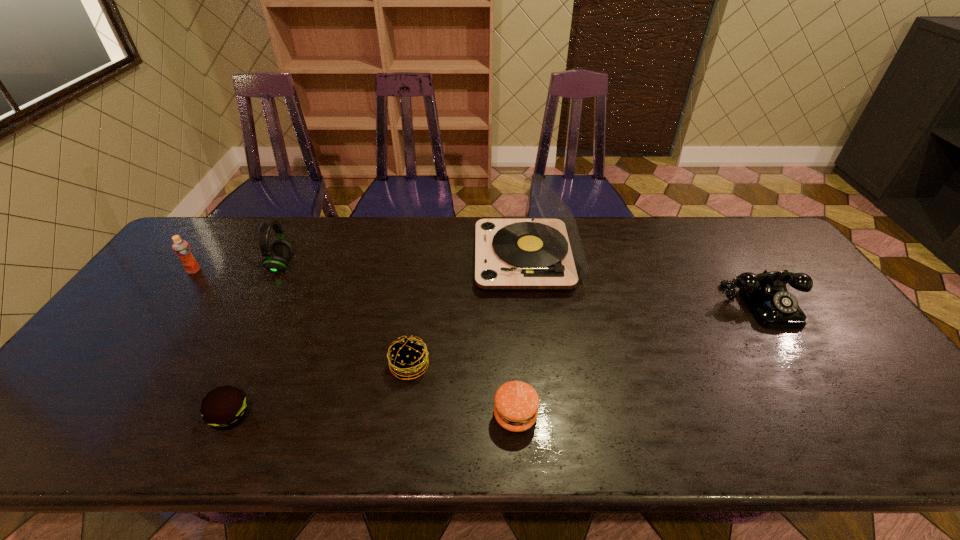
Locate an element on the screen. This screenshot has width=960, height=540. headset that is at the far edge is located at coordinates (276, 258).

Find the location of `object situated at the left edge`. object situated at the left edge is located at coordinates tap(181, 248).

Locate an element on the screen. Image resolution: width=960 pixels, height=540 pixels. object that is at the right edge is located at coordinates (765, 294).

Where is `free location at the far edge of the desktop`? This screenshot has height=540, width=960. free location at the far edge of the desktop is located at coordinates (270, 243).

In order to click on free space at the near edge of the desktop in this screenshot , I will do `click(698, 443)`.

You are a GUI agent. You are given a task and a screenshot of the screen. Output one action in this format:
    pyautogui.click(x=<x>, y=<y>)
    Task: Click on the free space at the left edge of the desktop
    Image resolution: width=960 pixels, height=540 pixels.
    Given the screenshot: What is the action you would take?
    pyautogui.click(x=159, y=309)

In the image, there is a desktop. Identify the location of vacant region at the right edge. (789, 291).

Where is `free location at the far left corner`? The height and width of the screenshot is (540, 960). free location at the far left corner is located at coordinates (215, 241).

The width and height of the screenshot is (960, 540). In order to click on free space at the far right corner in this screenshot , I will do `click(752, 251)`.

Image resolution: width=960 pixels, height=540 pixels. In order to click on free point between the record player and the fourth object from right to left in this screenshot , I will do `click(468, 312)`.